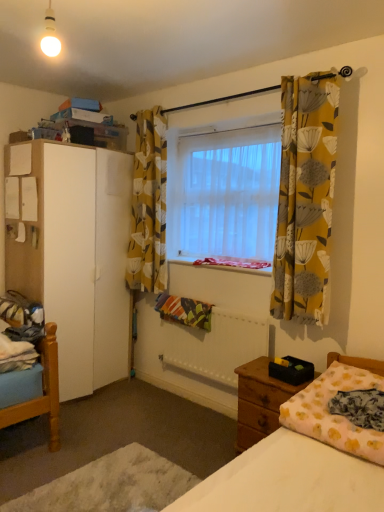
Measure the distance between point (47, 9) and camera.

A distance of 6.58 feet exists between point (47, 9) and camera.

Where is `pink floral blanket at lower right`? pink floral blanket at lower right is located at coordinates (360, 407).

The width and height of the screenshot is (384, 512). What are the coordinates of `wooden nightstand at lower right` in the screenshot? It's located at (260, 401).

The height and width of the screenshot is (512, 384). Describe the element at coordinates (305, 198) in the screenshot. I see `yellow floral fabric curtain at right, the first curtain positioned from the front` at that location.

Measure the distance between translucent fabric window at center and camera.

translucent fabric window at center is 8.70 feet away from camera.

This screenshot has height=512, width=384. What are the coordinates of `white glossy bulb at upper left` in the screenshot? It's located at (50, 35).

The width and height of the screenshot is (384, 512). What are the coordinates of `nightstand behind the yellow floral fabric curtain at right, which ranks as the first curtain in right-to-left order` in the screenshot? It's located at (260, 401).

Considering the positions of objects yellow floral fabric curtain at right, the first curtain positioned from the front, and wooden nightstand at lower right in the image provided, who is more to the right, yellow floral fabric curtain at right, the first curtain positioned from the front, or wooden nightstand at lower right?

Positioned to the right is yellow floral fabric curtain at right, the first curtain positioned from the front.

Is yellow floral fabric curtain at right, the first curtain positioned from the front, wider than wooden nightstand at lower right?

In fact, yellow floral fabric curtain at right, the first curtain positioned from the front, might be narrower than wooden nightstand at lower right.

In the scene shown: Is yellow floral fabric curtain at right, marked as the second curtain in a back-to-front arrangement, smaller than wooden nightstand at lower right?

Yes, yellow floral fabric curtain at right, marked as the second curtain in a back-to-front arrangement, is smaller than wooden nightstand at lower right.

Considering the positions of objects white fabric at center and blue cotton sheet at lower left in the image provided, who is more to the left, white fabric at center or blue cotton sheet at lower left?

blue cotton sheet at lower left.

From a real-world perspective, between white fabric at center and blue cotton sheet at lower left, who is vertically higher?

white fabric at center, from a real-world perspective.

Is white fabric at center far away from blue cotton sheet at lower left?

white fabric at center is positioned a significant distance from blue cotton sheet at lower left.

Is white fabric at center completely or partially outside of blue cotton sheet at lower left?

white fabric at center is positioned outside blue cotton sheet at lower left.

From a real-world perspective, is translucent fabric window at center positioned under wooden nightstand at lower right based on gravity?

Actually, translucent fabric window at center is physically above wooden nightstand at lower right in the real world.

Consider the image. Are translucent fabric window at center and wooden nightstand at lower right located far from each other?

Yes, translucent fabric window at center is far from wooden nightstand at lower right.

Is translucent fabric window at center positioned with its back to wooden nightstand at lower right?

No.

Where is `window to the left of wooden nightstand at lower right`? window to the left of wooden nightstand at lower right is located at coordinates (224, 191).

From a real-world perspective, between wooden nightstand at lower right and yellow floral fabric curtain at right, marked as the second curtain in a back-to-front arrangement, who is vertically higher?

yellow floral fabric curtain at right, marked as the second curtain in a back-to-front arrangement, is physically above.

Between wooden nightstand at lower right and yellow floral fabric curtain at right, which ranks as the first curtain in right-to-left order, which one appears on the right side from the viewer's perspective?

yellow floral fabric curtain at right, which ranks as the first curtain in right-to-left order, is more to the right.

Considering the relative sizes of wooden nightstand at lower right and yellow floral fabric curtain at right, which is the second curtain from left to right, in the image provided, is wooden nightstand at lower right bigger than yellow floral fabric curtain at right, which is the second curtain from left to right,?

Yes.

Is white fabric at center at the left side of wooden nightstand at lower right?

Yes.

Is wooden nightstand at lower right completely or partially inside white fabric at center?

No, white fabric at center does not contain wooden nightstand at lower right.

Looking at this image, from the image's perspective, does white fabric at center appear lower than wooden nightstand at lower right?

Incorrect, from the image's perspective, white fabric at center is higher than wooden nightstand at lower right.

Which is closer to the camera, [228,266] or [236,447]?

Clearly, point [228,266] is more distant from the camera than point [236,447].

Between point (43, 50) and point (25, 356), which one is positioned behind?

The point (43, 50) is behind.

From the image's perspective, between white glossy bulb at upper left and blue cotton sheet at lower left, who is located below?

From the image's view, blue cotton sheet at lower left is below.

Does white glossy bulb at upper left have a larger size compared to blue cotton sheet at lower left?

Incorrect, white glossy bulb at upper left is not larger than blue cotton sheet at lower left.

Is white glossy bulb at upper left further to camera compared to blue cotton sheet at lower left?

No, it is not.

From a real-world perspective, is white matte cabinet at left over wooden nightstand at lower right?

Yes, from a real-world perspective, white matte cabinet at left is above wooden nightstand at lower right.

Considering the positions of objects white matte cabinet at left and wooden nightstand at lower right in the image provided, who is more to the left, white matte cabinet at left or wooden nightstand at lower right?

Positioned to the left is white matte cabinet at left.

The height and width of the screenshot is (512, 384). I want to click on cabinetry behind the wooden nightstand at lower right, so click(x=76, y=257).

I want to click on curtain on the right of wooden nightstand at lower right, so coord(305,198).

Find the location of a particular element. The image size is (384, 512). window sill above the blue cotton sheet at lower left (from the image's perspective) is located at coordinates (225, 263).

Which object lies nearer to the anchor point white fabric bed at lower right, white fabric at center or yellow floral fabric curtain at right, which is the second curtain from left to right?

Among the two, yellow floral fabric curtain at right, which is the second curtain from left to right, is located nearer to white fabric bed at lower right.

Looking at the image, which one is located closer to pink floral blanket at lower right, white fabric bed at lower right or white fabric at center?

white fabric bed at lower right is closer to pink floral blanket at lower right.

Considering their positions, is white fabric bed at lower right positioned closer to pink floral blanket at lower right than translucent fabric window at center?

white fabric bed at lower right is closer to pink floral blanket at lower right.

Based on their spatial positions, is white fabric at center or yellow floral fabric curtain at right, the first curtain positioned from the front, further from white glossy bulb at upper left?

white fabric at center.

Estimate the real-world distances between objects in this image. Which object is further from wooden nightstand at lower right, yellow floral fabric curtain at right, which is the second curtain from left to right, or white glossy bulb at upper left?

white glossy bulb at upper left.

Consider the image. Based on their spatial positions, is white glossy bulb at upper left or wooden nightstand at lower right further from white fabric at center?

white glossy bulb at upper left lies further to white fabric at center than the other object.

Estimate the real-world distances between objects in this image. Which object is further from yellow floral fabric curtain at upper center, the 2th curtain from the right, white fabric bed at lower right or white fabric at center?

Based on the image, white fabric bed at lower right appears to be further to yellow floral fabric curtain at upper center, the 2th curtain from the right.

Which object lies nearer to the anchor point white fabric at center, white matte cabinet at left or pink floral blanket at lower right?

The object closer to white fabric at center is white matte cabinet at left.

Image resolution: width=384 pixels, height=512 pixels. I want to click on blanket between white glossy bulb at upper left and wooden nightstand at lower right vertically, so click(x=360, y=407).

Identify the location of mattress that lies between yellow floral fabric curtain at right, marked as the second curtain in a back-to-front arrangement, and wooden nightstand at lower right from top to bottom. This screenshot has width=384, height=512. (335, 415).

This screenshot has height=512, width=384. I want to click on curtain between blue cotton sheet at lower left and translucent fabric window at center in the horizontal direction, so click(x=149, y=206).

Locate an element on the screen. The image size is (384, 512). mattress between white glossy bulb at upper left and wooden nightstand at lower right in the up-down direction is located at coordinates (335, 415).